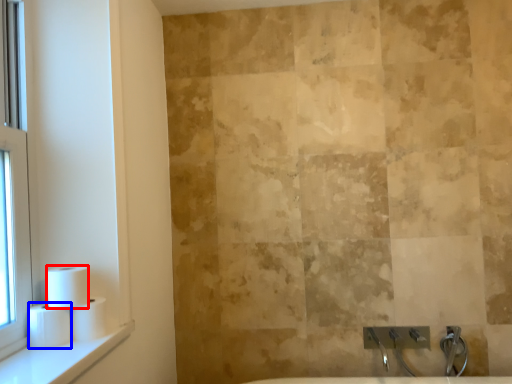
Question: Which of the following is the farthest to the observer, toilet paper (highlighted by a red box) or toilet paper (highlighted by a blue box)?

Choices:
 (A) toilet paper
 (B) toilet paper

Answer: (A)